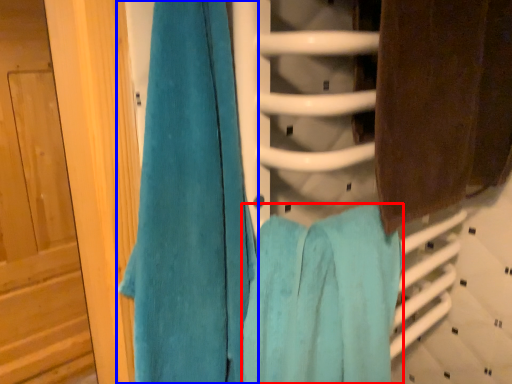
Question: Among these objects, which one is farthest to the camera, towel (highlighted by a red box) or towel (highlighted by a blue box)?

Choices:
 (A) towel
 (B) towel

Answer: (A)